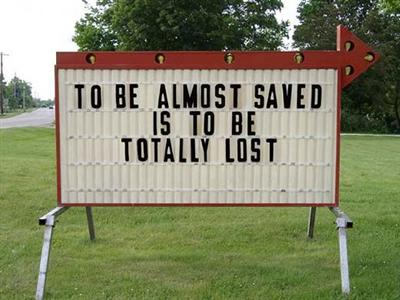
Identify the location of frame front leg. This screenshot has width=400, height=300. (42, 263), (343, 261).